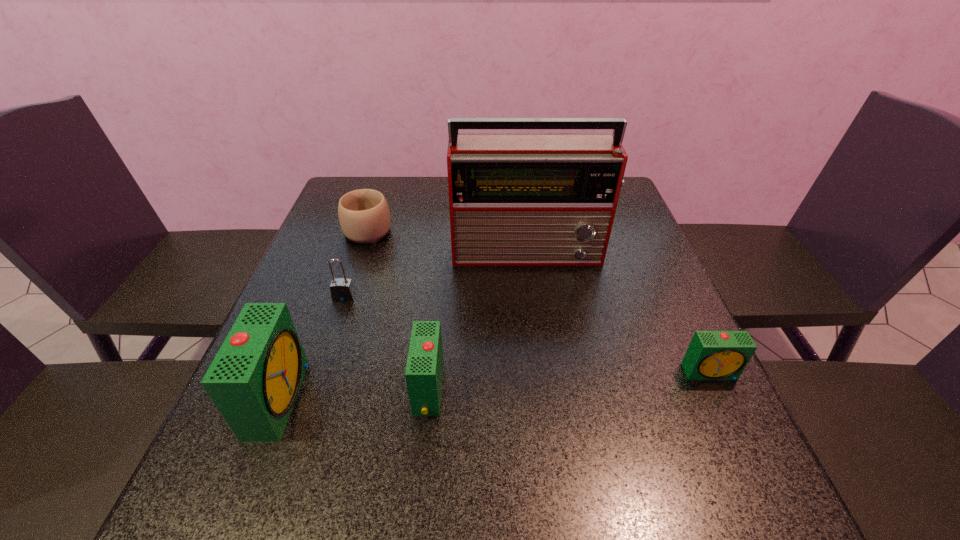
You are a GUI agent. You are given a task and a screenshot of the screen. Output one action in this format:
    pyautogui.click(x=<x>, y=<y>)
    Task: Click on the object that is at the far edge
    This screenshot has width=960, height=540.
    Given the screenshot: What is the action you would take?
    pyautogui.click(x=364, y=216)

Identify the location of alarm clock at the left edge. (254, 379).

Find the location of a particular element. The width and height of the screenshot is (960, 540). mug at the left edge is located at coordinates (364, 216).

Image resolution: width=960 pixels, height=540 pixels. In order to click on padlock situated at the left edge in this screenshot , I will do `click(342, 290)`.

In order to click on alarm clock positioned at the right edge in this screenshot , I will do `click(712, 355)`.

Image resolution: width=960 pixels, height=540 pixels. I want to click on radio receiver at the right edge, so click(515, 199).

Find the location of a particular element. The height and width of the screenshot is (540, 960). object located at the far left corner is located at coordinates (364, 216).

The width and height of the screenshot is (960, 540). In order to click on object located in the near left corner section of the desktop in this screenshot , I will do `click(254, 379)`.

Locate an element on the screen. free space at the far edge is located at coordinates (427, 216).

In the image, there is a desktop. Where is `vacant region at the near edge`? This screenshot has height=540, width=960. vacant region at the near edge is located at coordinates (527, 426).